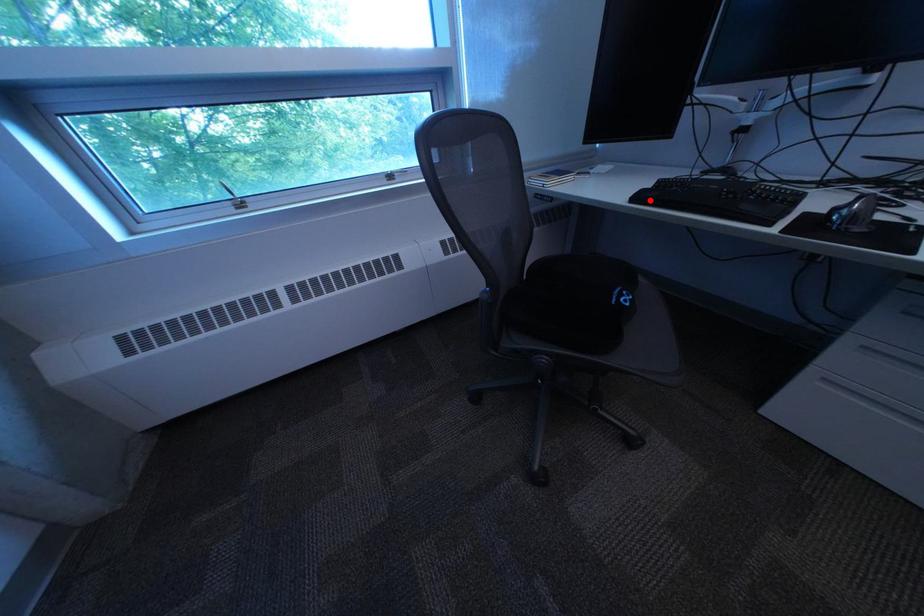
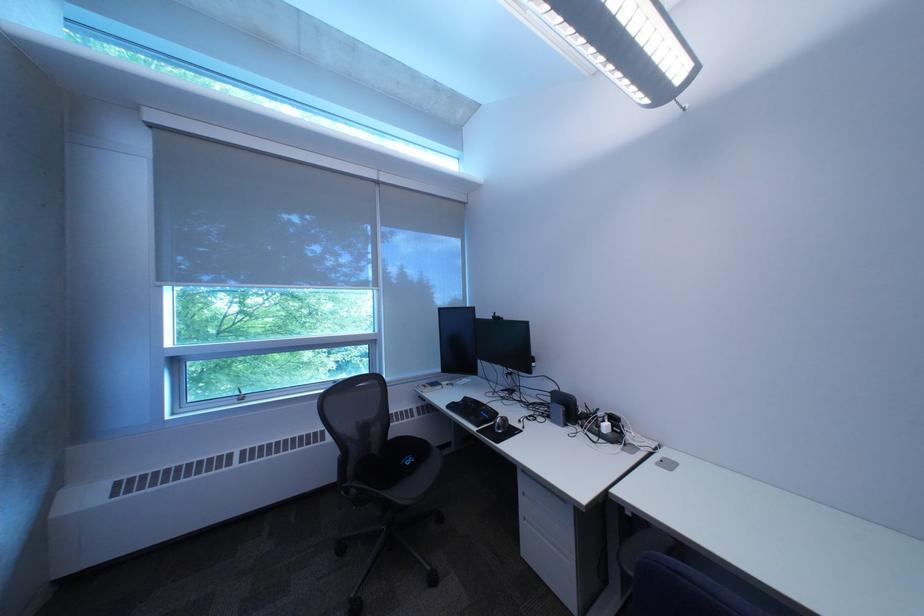
The point at the highlighted location is marked in the first image. Where is the corresponding point in the second image?

(464, 408)